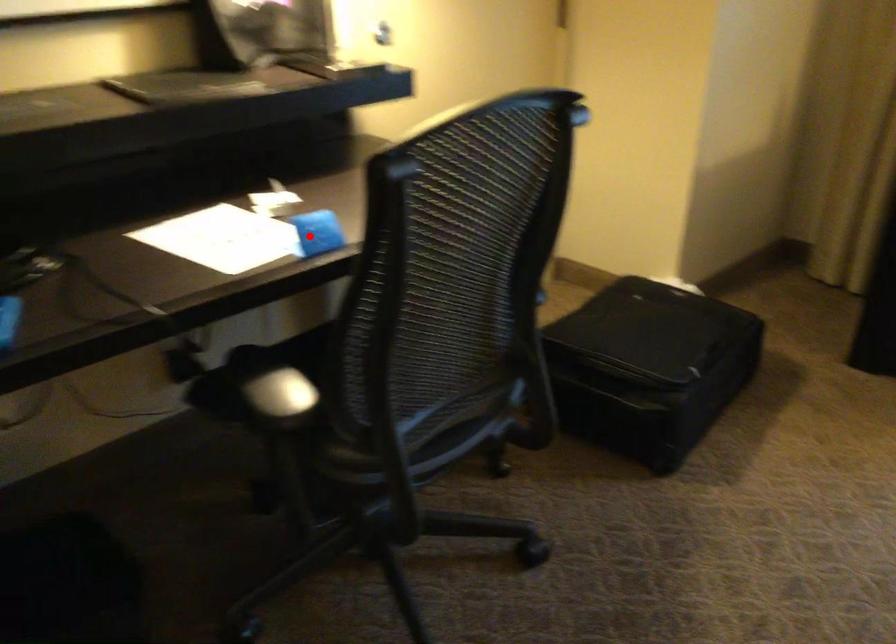
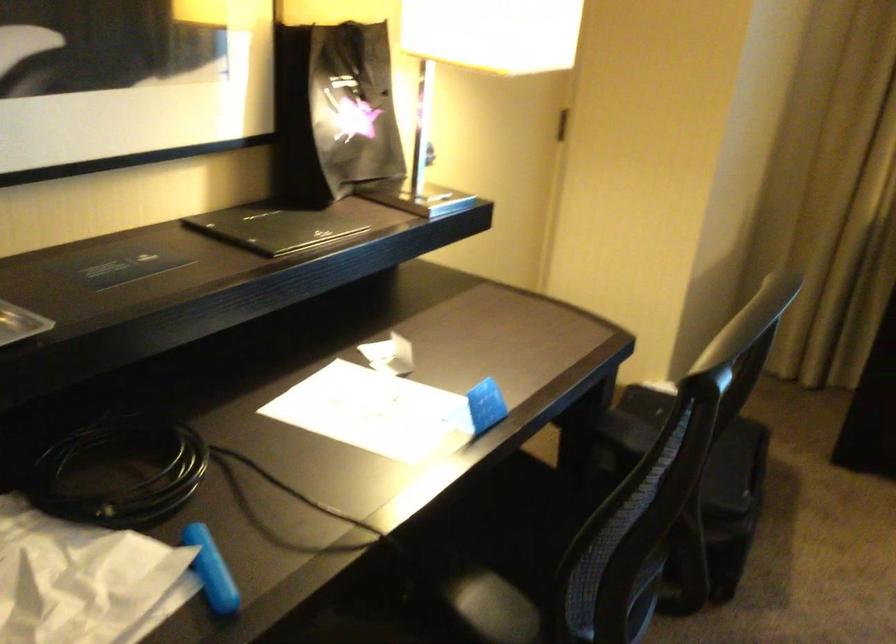
Where in the second image is the point corresponding to the highlighted location from the first image?

(479, 408)